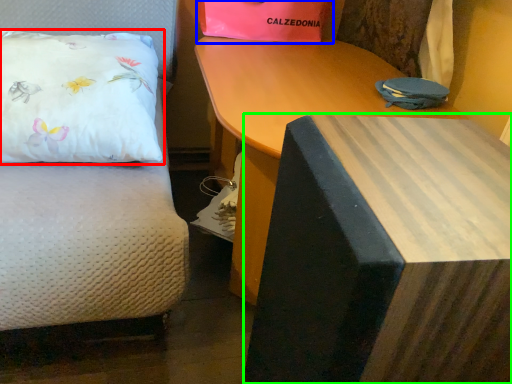
Question: Which is farther away from pillow (highlighted by a red box)? gift bag (highlighted by a blue box) or table (highlighted by a green box)?

Choices:
 (A) gift bag
 (B) table

Answer: (B)